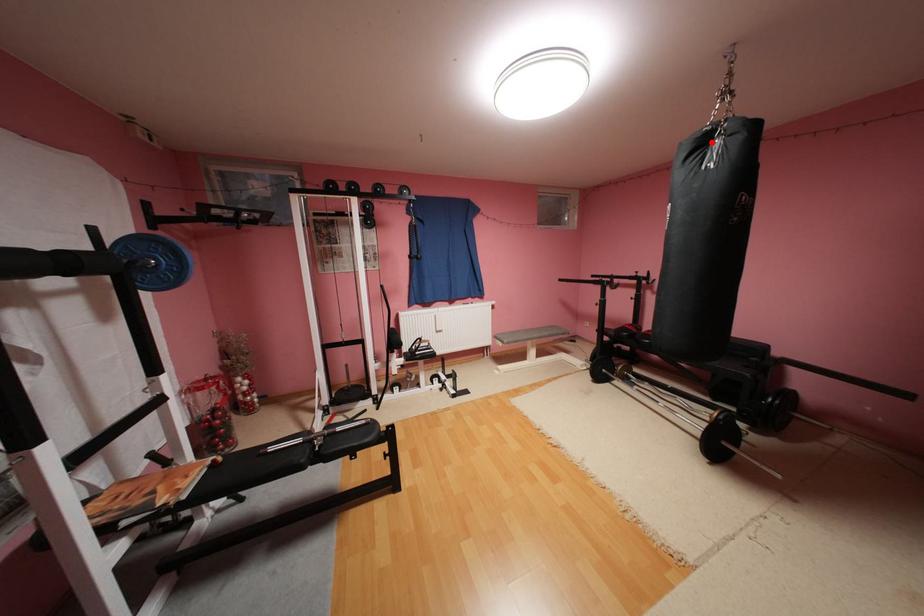
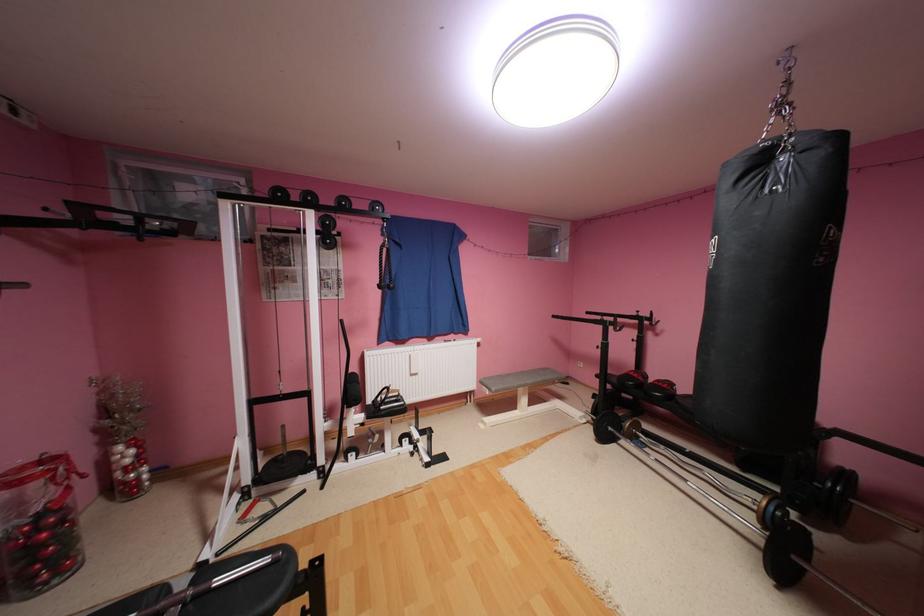
Question: I am providing you with two images of the same scene from different viewpoints. A red point is marked on the first image. Is the red point's position out of view in image 2?

Choices:
 (A) Yes
 (B) No

Answer: (B)